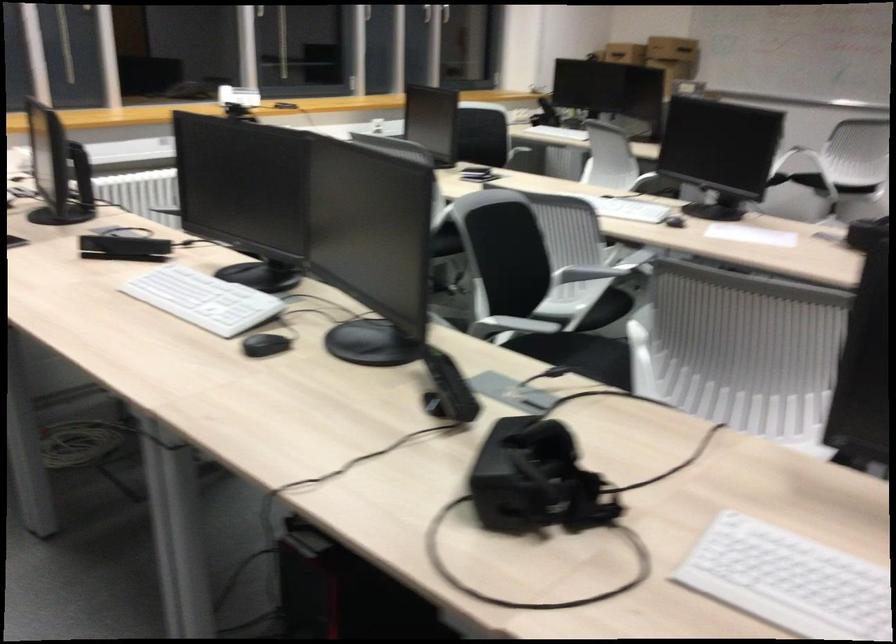
The width and height of the screenshot is (896, 644). What do you see at coordinates (448, 389) in the screenshot?
I see `the telephone handset` at bounding box center [448, 389].